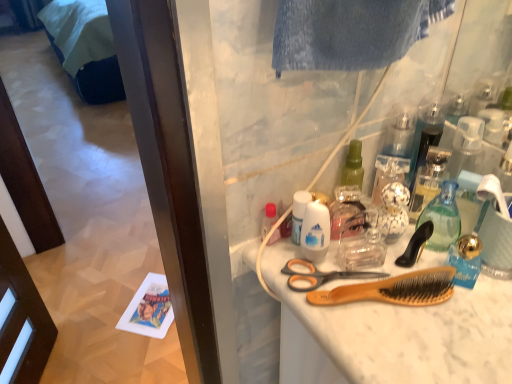
Question: Is white matte deodorant at center, marked as the 2th cleaning product in a back-to-front arrangement, taller or shorter than orange plastic scissors at center?

Choices:
 (A) tall
 (B) short

Answer: (A)

Question: Is white matte deodorant at center, the second cleaning product viewed from the right, bigger or smaller than orange plastic scissors at center?

Choices:
 (A) big
 (B) small

Answer: (A)

Question: Estimate the real-world distances between objects in this image. Which object is closer to the transparent plastic bottle at center, the 2th cleaning product positioned from the front?

Choices:
 (A) orange plastic scissors at center
 (B) dark blue fabric bed at lower left
 (C) translucent plastic bottle at center
 (D) wooden bristle brush at center, arranged as the 1th brush when ordered from the bottom
 (E) transparent glass perfume at upper right

Answer: (A)

Question: Estimate the real-world distances between objects in this image. Which object is farther from the wooden bristle brush at center, which is the second brush from top to bottom?

Choices:
 (A) orange plastic scissors at center
 (B) dark blue fabric bed at lower left
 (C) translucent plastic bottle at center
 (D) black plastic brush at upper right, the 1th brush positioned from the top
 (E) transparent glass perfume at upper right

Answer: (B)